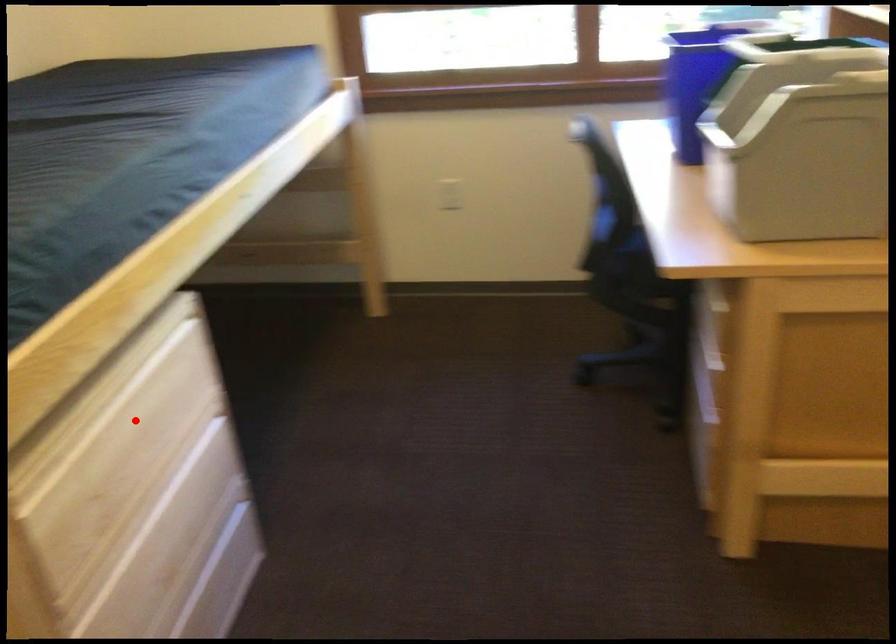
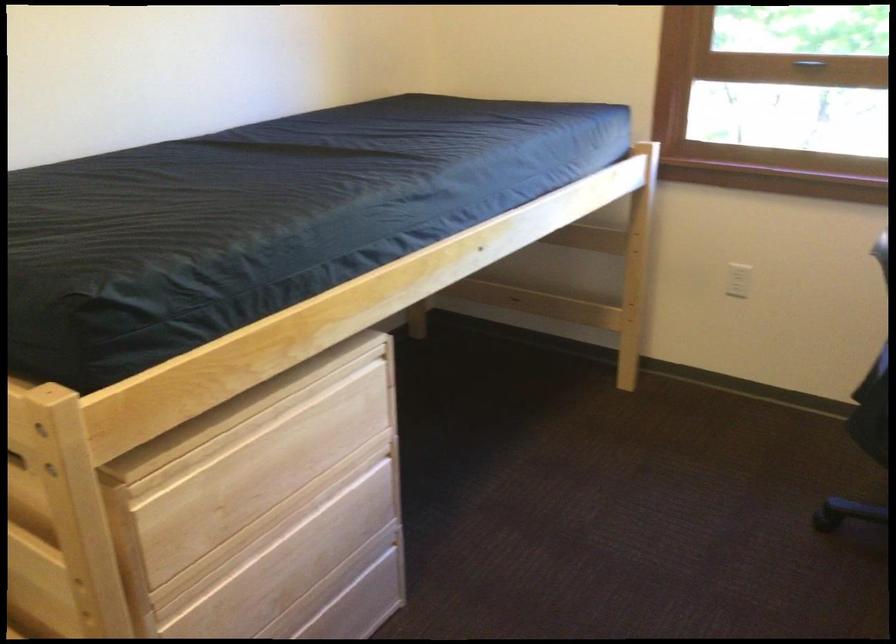
In the second image, find the point that corresponds to the highlighted location in the first image.

(285, 448)